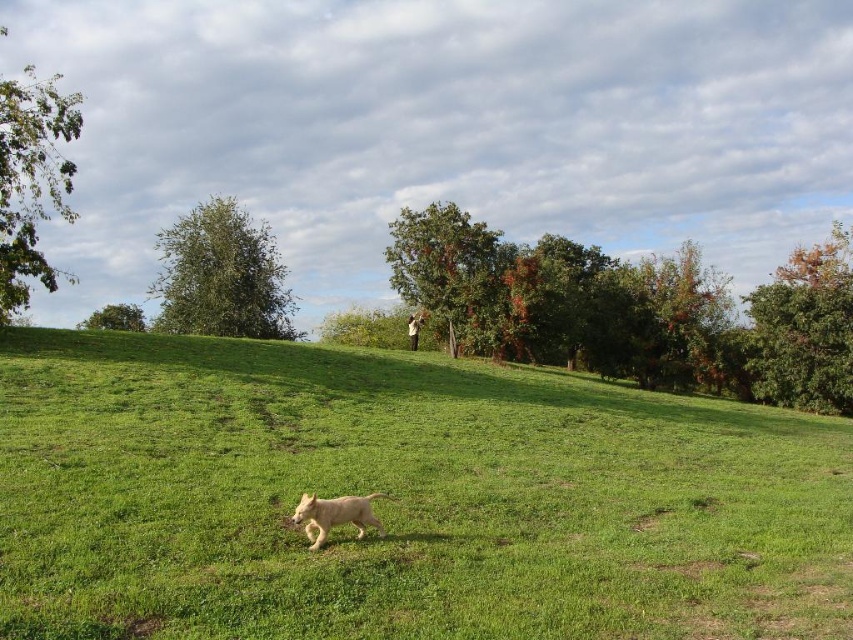
Does green grassy field at center have a greater height compared to white fur dog at center?

Correct, green grassy field at center is much taller as white fur dog at center.

Can you confirm if green grassy field at center is smaller than white fur dog at center?

No.

Which is in front, point (161, 547) or point (329, 518)?

Point (161, 547)

Locate an element on the screen. This screenshot has height=640, width=853. green grassy field at center is located at coordinates 401,499.